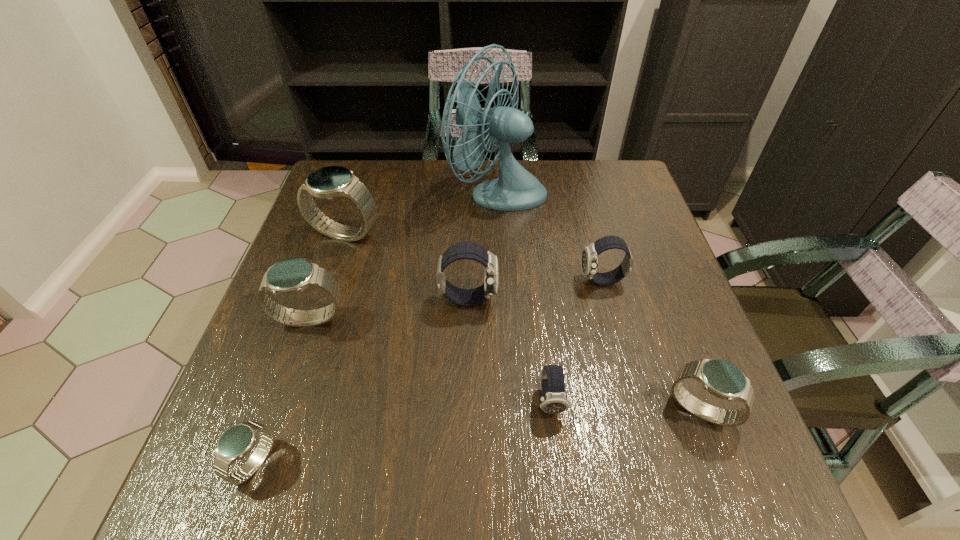
What are the coordinates of `fan` in the screenshot? It's located at (516, 189).

At what (x,y) coordinates should I click in order to perform the action: click on the farthest watch. Please return your answer as a coordinate pair (x, y). This screenshot has height=540, width=960. Looking at the image, I should click on (329, 182).

This screenshot has height=540, width=960. In order to click on the farthest blue watch in this screenshot , I will do (x=329, y=182).

The image size is (960, 540). What are the coordinates of `the biggest dark watch` in the screenshot? It's located at (462, 250).

Find the location of a particular element. The height and width of the screenshot is (540, 960). the leftmost dark watch is located at coordinates (462, 250).

Locate an element on the screen. the second farthest blue watch is located at coordinates (290, 276).

This screenshot has width=960, height=540. I want to click on the second biggest dark watch, so click(590, 255).

The width and height of the screenshot is (960, 540). Identify the location of the sixth watch from left to right. (590, 255).

In order to click on the rightmost blue watch in this screenshot , I will do `click(721, 378)`.

The width and height of the screenshot is (960, 540). I want to click on the third biggest blue watch, so click(721, 378).